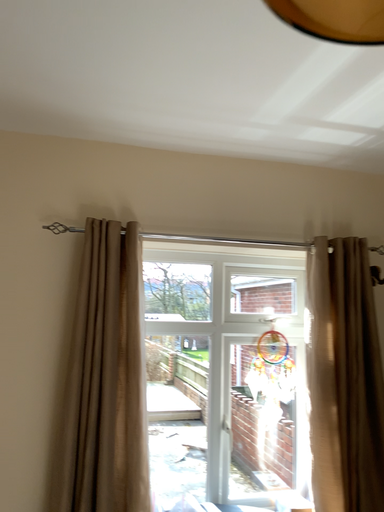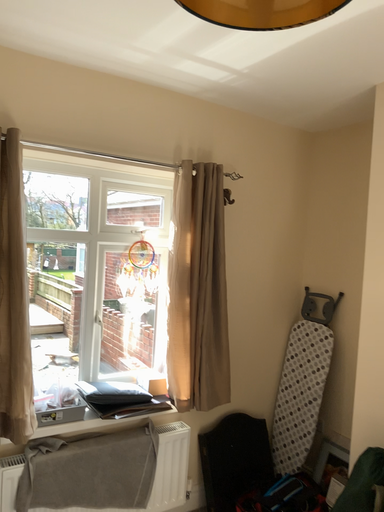
Question: Which way did the camera rotate in the video?

Choices:
 (A) rotated right
 (B) rotated left

Answer: (A)